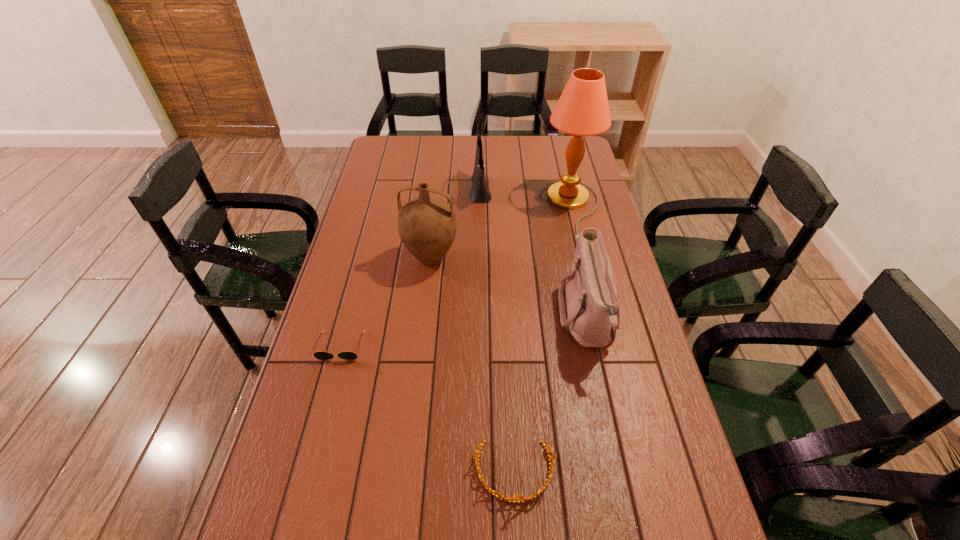
Find the location of a particular element. vacant region at the far edge is located at coordinates (537, 164).

The height and width of the screenshot is (540, 960). I want to click on free location at the left edge of the desktop, so click(x=343, y=274).

Image resolution: width=960 pixels, height=540 pixels. In the image, there is a desktop. Find the location of `free region at the right edge`. free region at the right edge is located at coordinates (604, 224).

In the image, there is a desktop. Where is `vacant area at the far left corner`? The image size is (960, 540). vacant area at the far left corner is located at coordinates [402, 143].

What are the coordinates of `vacant region between the tiara and the pitcher` in the screenshot? It's located at (472, 366).

I want to click on free space between the second object from left to right and the second shortest object, so click(x=472, y=366).

Where is `empty location between the leftmost object and the nearest object`? This screenshot has width=960, height=540. empty location between the leftmost object and the nearest object is located at coordinates (428, 409).

Identify the location of free space between the pitcher and the nearer shoulder bag. (509, 289).

Locate an element on the screen. free point between the third shortest object and the tiara is located at coordinates (551, 395).

The image size is (960, 540). I want to click on free area in between the tiara and the left shoulder bag, so click(497, 331).